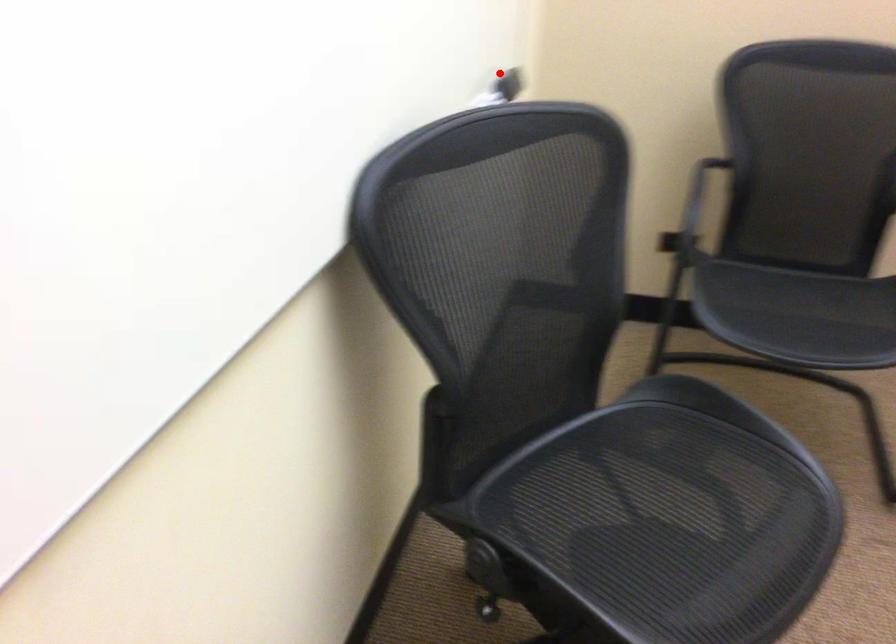
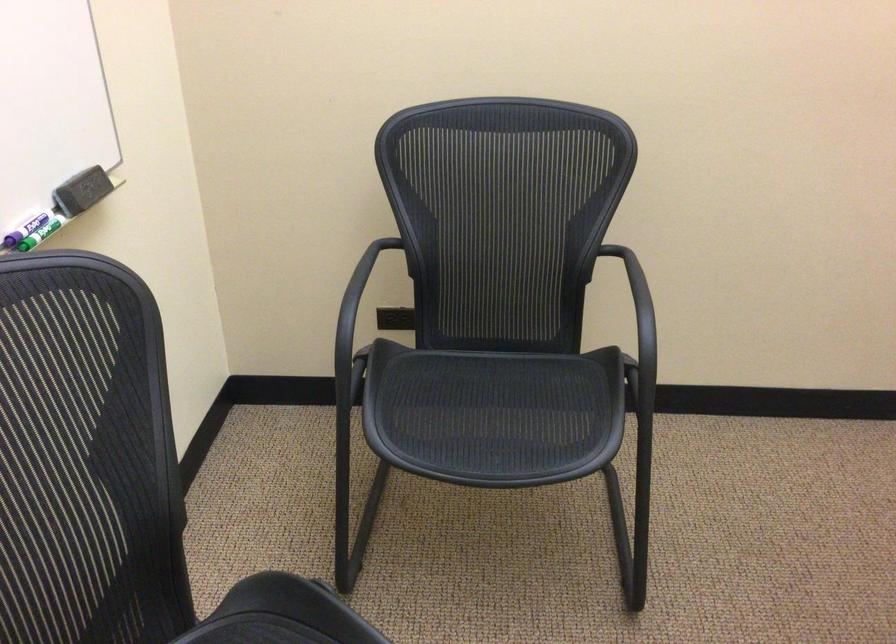
Locate, in the second image, the point that corresponds to the highlighted location in the first image.

(82, 191)